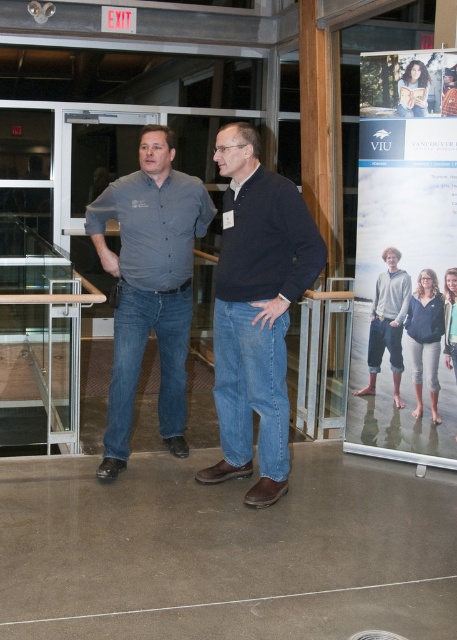
You are a photographer setting up for a group photo. You have two subjects wearing the matte gray shirt at center and the gray cotton hoodie at center. Considering their heights, which clothing item should you adjust the camera angle for to ensure both subjects are framed properly?

The matte gray shirt at center is much taller than the gray cotton hoodie at center, so you should adjust the camera angle to account for the height difference between the two subjects.

You are an event organizer at VIU and need to arrange a photo shoot. You want to ensure that the dark blue sweater at center and the matte black hair at upper center are both visible in the frame. Given their sizes, which object should you prioritize positioning closer to the camera to maintain clarity?

The dark blue sweater at center should be positioned closer to the camera since its width is larger than the matte black hair at upper center, ensuring both objects remain clear in the photo.

You are an observer in the scene and want to know which object is taller between the dark blue sweater at center and the matte black hair at upper center. Based on the scene description, can you determine which one is taller?

The dark blue sweater at center is much taller than the matte black hair at upper center.